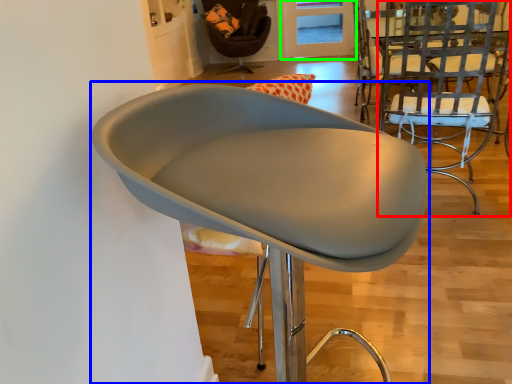
Question: Considering the real-world distances, which object is closest to chair (highlighted by a red box)? chair (highlighted by a blue box) or glass door (highlighted by a green box).

Choices:
 (A) chair
 (B) glass door

Answer: (A)